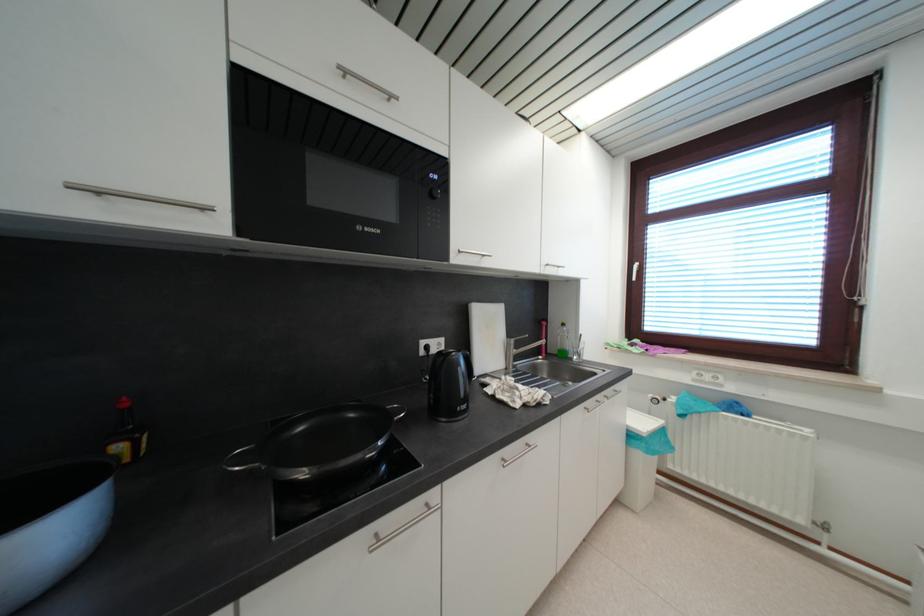
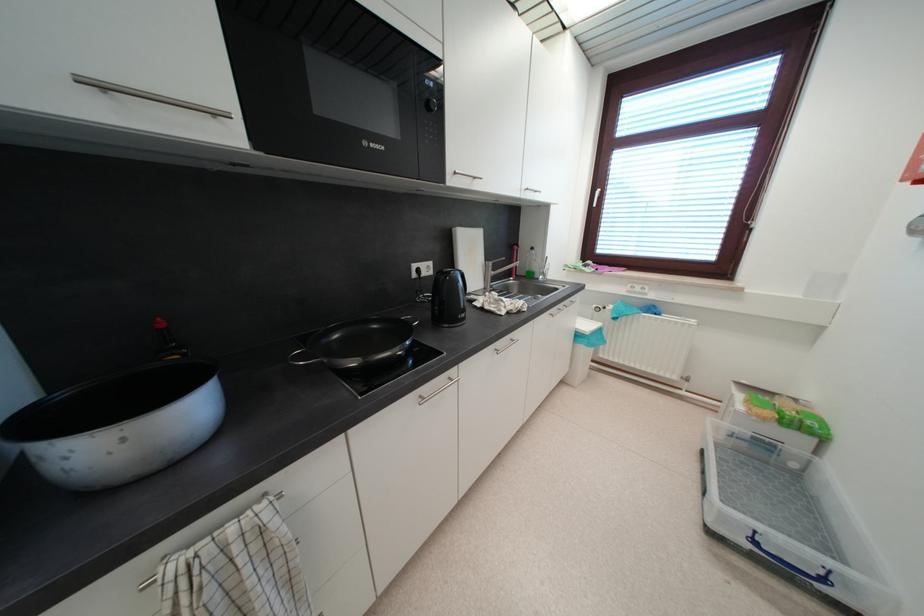
The point at (x=382, y=538) is marked in the first image. Where is the corresponding point in the second image?

(427, 400)